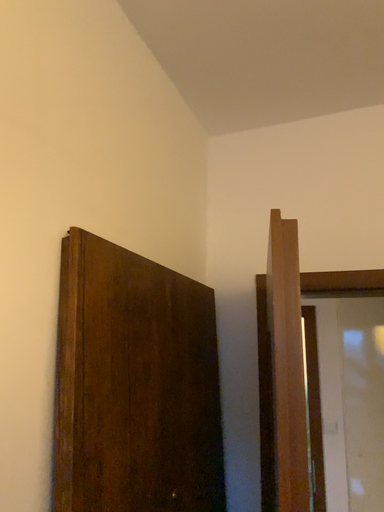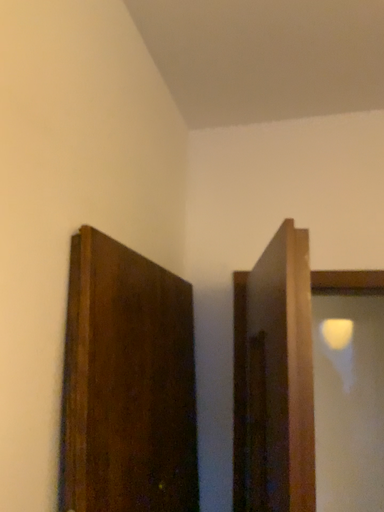
Question: Which way did the camera rotate in the video?

Choices:
 (A) rotated right
 (B) rotated left

Answer: (A)